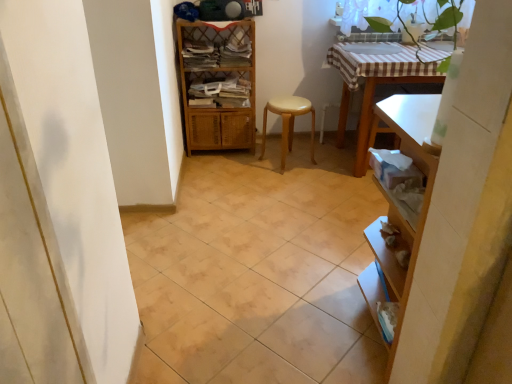
Question: Is beige ceramic tile at center taller than woven wood shelf at center?

Choices:
 (A) no
 (B) yes

Answer: (A)

Question: Is beige ceramic tile at center directly adjacent to woven wood shelf at center?

Choices:
 (A) yes
 (B) no

Answer: (B)

Question: Does beige ceramic tile at center have a lesser width compared to woven wood shelf at center?

Choices:
 (A) no
 (B) yes

Answer: (A)

Question: From the image's perspective, is beige ceramic tile at center located above woven wood shelf at center?

Choices:
 (A) yes
 (B) no

Answer: (B)

Question: Is woven wood shelf at center at the back of beige ceramic tile at center?

Choices:
 (A) no
 (B) yes

Answer: (A)

Question: From a real-world perspective, is white glossy sink at upper center positioned above or below woven wood shelf at center?

Choices:
 (A) below
 (B) above

Answer: (B)

Question: Is white glossy sink at upper center wider or thinner than woven wood shelf at center?

Choices:
 (A) thin
 (B) wide

Answer: (B)

Question: Considering the positions of white glossy sink at upper center and woven wood shelf at center in the image, is white glossy sink at upper center taller or shorter than woven wood shelf at center?

Choices:
 (A) tall
 (B) short

Answer: (B)

Question: Visually, is white glossy sink at upper center positioned to the left or to the right of woven wood shelf at center?

Choices:
 (A) left
 (B) right

Answer: (B)

Question: Is point (373, 46) closer or farther from the camera than point (304, 104)?

Choices:
 (A) farther
 (B) closer

Answer: (B)

Question: Considering the positions of white glossy sink at upper center and light brown wooden stool at center in the image, is white glossy sink at upper center bigger or smaller than light brown wooden stool at center?

Choices:
 (A) big
 (B) small

Answer: (B)

Question: From the image's perspective, is white glossy sink at upper center above or below light brown wooden stool at center?

Choices:
 (A) below
 (B) above

Answer: (B)

Question: Is white glossy sink at upper center inside or outside of light brown wooden stool at center?

Choices:
 (A) outside
 (B) inside

Answer: (A)

Question: From a real-world perspective, relative to beige ceramic tile at center, is light brown wooden stool at center vertically above or below?

Choices:
 (A) above
 (B) below

Answer: (A)

Question: Is light brown wooden stool at center wider or thinner than beige ceramic tile at center?

Choices:
 (A) thin
 (B) wide

Answer: (A)